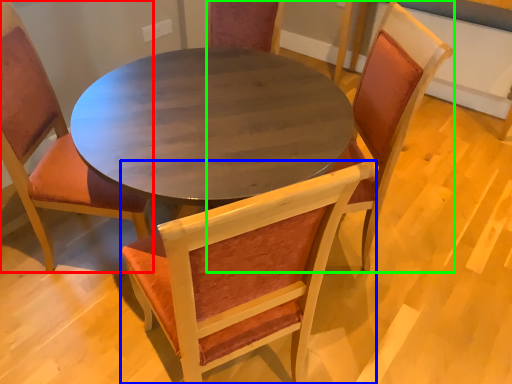
Question: Which object is the farthest from chair (highlighted by a red box)? Choose among these: chair (highlighted by a blue box) or chair (highlighted by a green box).

Choices:
 (A) chair
 (B) chair

Answer: (B)